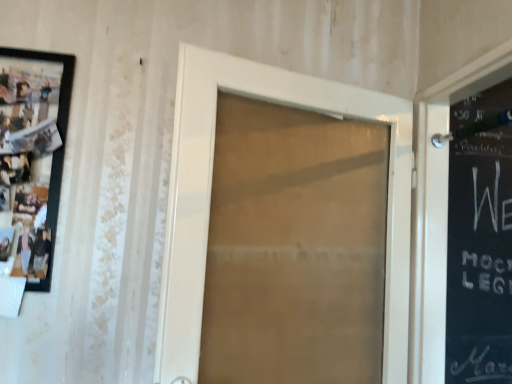
The width and height of the screenshot is (512, 384). What do you see at coordinates (211, 190) in the screenshot?
I see `white glossy door at center` at bounding box center [211, 190].

I want to click on white glossy door at center, so click(x=211, y=190).

Image resolution: width=512 pixels, height=384 pixels. I want to click on matte black picture frame at left, so click(x=32, y=158).

In order to face matte black picture frame at left, should I rotate leftwards or rightwards?

You should rotate left by 29.017 degrees.

This screenshot has width=512, height=384. What do you see at coordinates (32, 158) in the screenshot?
I see `matte black picture frame at left` at bounding box center [32, 158].

The height and width of the screenshot is (384, 512). Find the location of `white glossy door at center`. white glossy door at center is located at coordinates (211, 190).

Can you confirm if white glossy door at center is positioned to the left of matte black picture frame at left?

In fact, white glossy door at center is to the right of matte black picture frame at left.

Which object is further away from the camera taking this photo, white glossy door at center or matte black picture frame at left?

matte black picture frame at left is behind.

Which point is more forward, (377,96) or (33,247)?

The point (33,247) is more forward.

From the picture: From the image's perspective, which one is positioned higher, white glossy door at center or matte black picture frame at left?

matte black picture frame at left.

From a real-world perspective, between white glossy door at center and matte black picture frame at left, who is vertically lower?

white glossy door at center.

Looking at this image, does white glossy door at center have a greater width compared to matte black picture frame at left?

Indeed, white glossy door at center has a greater width compared to matte black picture frame at left.

Can you confirm if white glossy door at center is taller than matte black picture frame at left?

Indeed, white glossy door at center has a greater height compared to matte black picture frame at left.

Who is bigger, white glossy door at center or matte black picture frame at left?

white glossy door at center.

Is white glossy door at center outside of matte black picture frame at left?

Yes, white glossy door at center is not within matte black picture frame at left.

Is white glossy door at center beside matte black picture frame at left?

No, white glossy door at center is not in contact with matte black picture frame at left.

Consider the image. Could you tell me if white glossy door at center is turned towards matte black picture frame at left?

No, white glossy door at center is not turned towards matte black picture frame at left.

Can you tell me how much white glossy door at center and matte black picture frame at left differ in facing direction?

19.2 degrees.

Measure the distance from white glossy door at center to matte black picture frame at left.

white glossy door at center and matte black picture frame at left are 24.49 inches apart.

Identify the location of door below the matte black picture frame at left (from the image's perspective). The width and height of the screenshot is (512, 384). (211, 190).

Considering the positions of objects matte black picture frame at left and white glossy door at center in the image provided, who is more to the left, matte black picture frame at left or white glossy door at center?

matte black picture frame at left.

Is matte black picture frame at left further to the viewer compared to white glossy door at center?

Yes, it is behind white glossy door at center.

Is point (20, 204) closer to viewer compared to point (387, 299)?

Yes, point (20, 204) is closer to viewer.

From the image's perspective, which is above, matte black picture frame at left or white glossy door at center?

matte black picture frame at left.

From a real-world perspective, is matte black picture frame at left below white glossy door at center?

No.

Considering the relative sizes of matte black picture frame at left and white glossy door at center in the image provided, is matte black picture frame at left wider than white glossy door at center?

In fact, matte black picture frame at left might be narrower than white glossy door at center.

Can you confirm if matte black picture frame at left is taller than white glossy door at center?

No, matte black picture frame at left is not taller than white glossy door at center.

Between matte black picture frame at left and white glossy door at center, which one has smaller size?

Smaller between the two is matte black picture frame at left.

Looking at this image, would you say matte black picture frame at left is outside white glossy door at center?

Yes.

Is there a large distance between matte black picture frame at left and white glossy door at center?

No, there isn't a large distance between matte black picture frame at left and white glossy door at center.

Could you tell me if matte black picture frame at left is facing white glossy door at center?

No.

How many degrees apart are the facing directions of matte black picture frame at left and white glossy door at center?

The facing directions of matte black picture frame at left and white glossy door at center are 19.2 degrees apart.

Locate an element on the screen. door on the right of the matte black picture frame at left is located at coordinates (211, 190).

I want to click on door in front of the matte black picture frame at left, so click(211, 190).

Where is `picture frame above the white glossy door at center (from a real-world perspective)`? This screenshot has height=384, width=512. picture frame above the white glossy door at center (from a real-world perspective) is located at coordinates (32, 158).